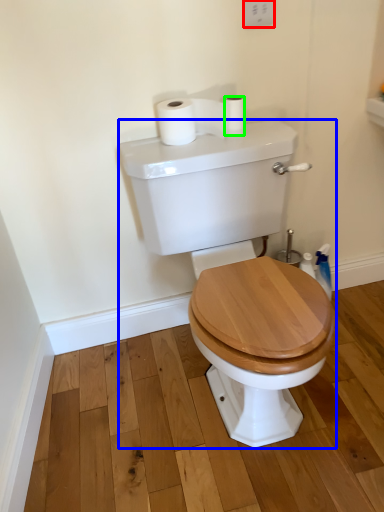
Question: Which object is the closest to the electric outlet (highlighted by a red box)? Choose among these: porcelain (highlighted by a blue box) or toilet paper (highlighted by a green box).

Choices:
 (A) porcelain
 (B) toilet paper

Answer: (B)